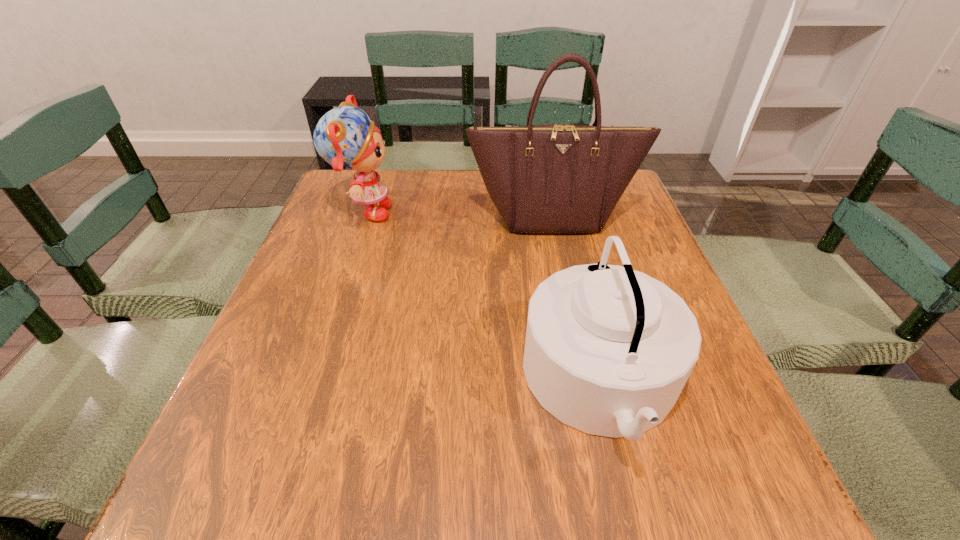
The width and height of the screenshot is (960, 540). Find the location of `the tallest object`. the tallest object is located at coordinates (556, 178).

This screenshot has width=960, height=540. Find the location of `doll`. doll is located at coordinates (345, 138).

At what (x,y) coordinates should I click in order to perform the action: click on the nearest object. Please return your answer as a coordinate pair (x, y). The image size is (960, 540). Looking at the image, I should click on (608, 350).

Locate an element on the screen. The width and height of the screenshot is (960, 540). vacant space located 0.090m on the front-facing side of the tallest object is located at coordinates (561, 260).

Where is `free space located 0.110m on the face of the leftmost object`? The height and width of the screenshot is (540, 960). free space located 0.110m on the face of the leftmost object is located at coordinates (436, 213).

Identify the location of free space located on the spout of the kettle. The image size is (960, 540). (313, 384).

What are the coordinates of `vacant space located on the spout of the kettle` in the screenshot? It's located at (472, 384).

This screenshot has height=540, width=960. Find the location of `free space located 0.210m on the spout of the kettle`. free space located 0.210m on the spout of the kettle is located at coordinates (404, 384).

This screenshot has width=960, height=540. In order to click on handbag located at the far edge in this screenshot , I will do `click(556, 178)`.

Where is `doll that is at the far edge`? doll that is at the far edge is located at coordinates (345, 138).